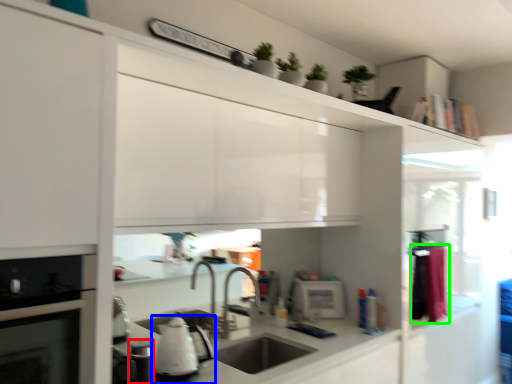
Question: Estimate the real-world distances between objects in this image. Which object is farther from appliance (highlighted by a red box), kitchen appliance (highlighted by a blue box) or laundry (highlighted by a green box)?

Choices:
 (A) kitchen appliance
 (B) laundry

Answer: (B)